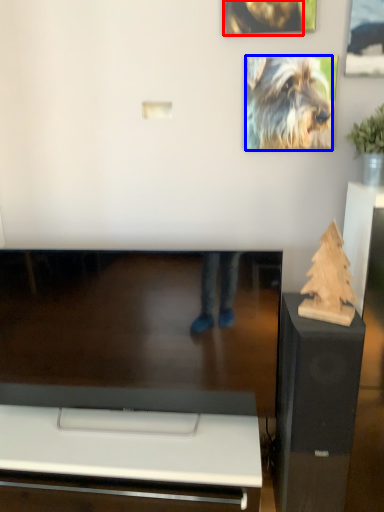
Question: Which point is closer to the camera, dog (highlighted by a red box) or dog (highlighted by a blue box)?

Choices:
 (A) dog
 (B) dog

Answer: (A)